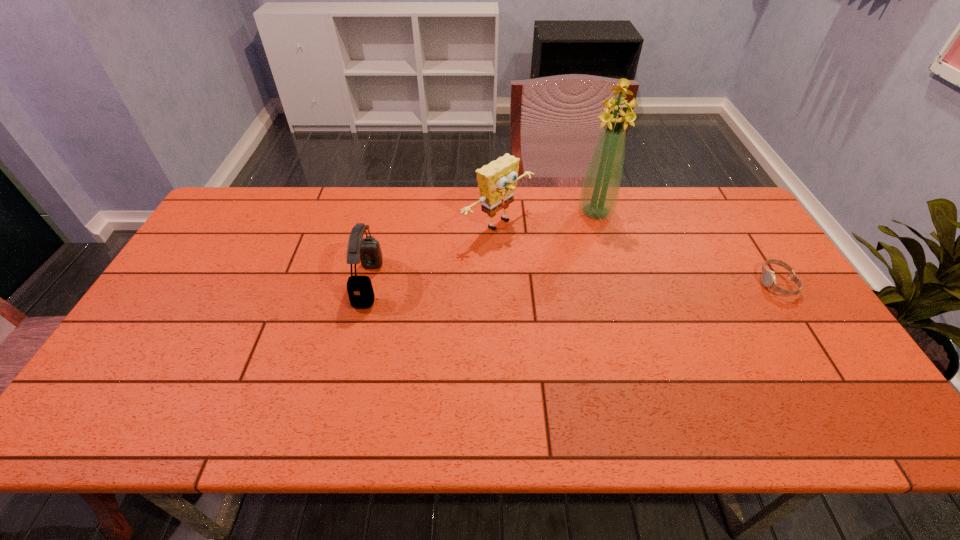
You are a GUI agent. You are given a task and a screenshot of the screen. Output one action in this format:
    pyautogui.click(x=<x>, y=<y>)
    Task: Click on the sponge at the far edge
    
    Given the screenshot: What is the action you would take?
    pyautogui.click(x=497, y=181)

Where is `object located at the right edge`? This screenshot has width=960, height=540. object located at the right edge is located at coordinates (768, 276).

Where is `vacant region at the far edge of the desktop`? Image resolution: width=960 pixels, height=540 pixels. vacant region at the far edge of the desktop is located at coordinates (377, 212).

The height and width of the screenshot is (540, 960). I want to click on vacant space at the near edge of the desktop, so click(244, 365).

Locate an element on the screen. This screenshot has height=540, width=960. free space at the left edge of the desktop is located at coordinates click(x=209, y=245).

At what (x,y) coordinates should I click in order to perform the action: click on free space at the far left corner of the desktop. Please return your answer as a coordinate pair (x, y). This screenshot has height=540, width=960. Looking at the image, I should click on (225, 225).

Where is `vacant area between the third object from left to right and the watch`? The image size is (960, 540). vacant area between the third object from left to right and the watch is located at coordinates [x=686, y=247].

Locate an element on the screen. free space between the tallest object and the watch is located at coordinates (686, 247).

You are a GUI agent. You are given a task and a screenshot of the screen. Output one action in this format:
    pyautogui.click(x=<x>, y=<y>)
    Task: Click on the free space that is in between the bouquet and the headset
    The image size is (960, 540).
    Given the screenshot: What is the action you would take?
    pyautogui.click(x=482, y=247)

This screenshot has width=960, height=540. What are the coordinates of `unoccupied area between the tallest object and the leftmost object` in the screenshot? It's located at (482, 247).